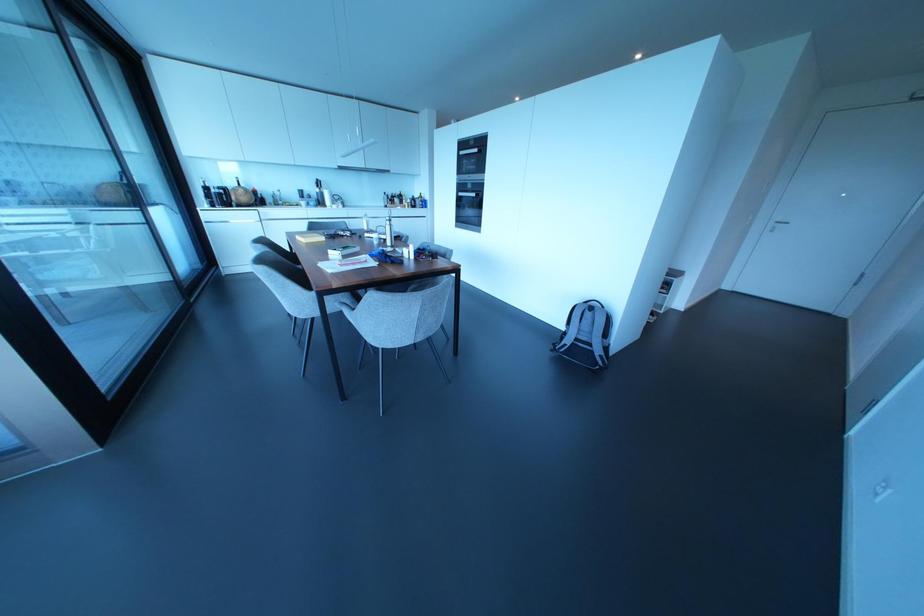
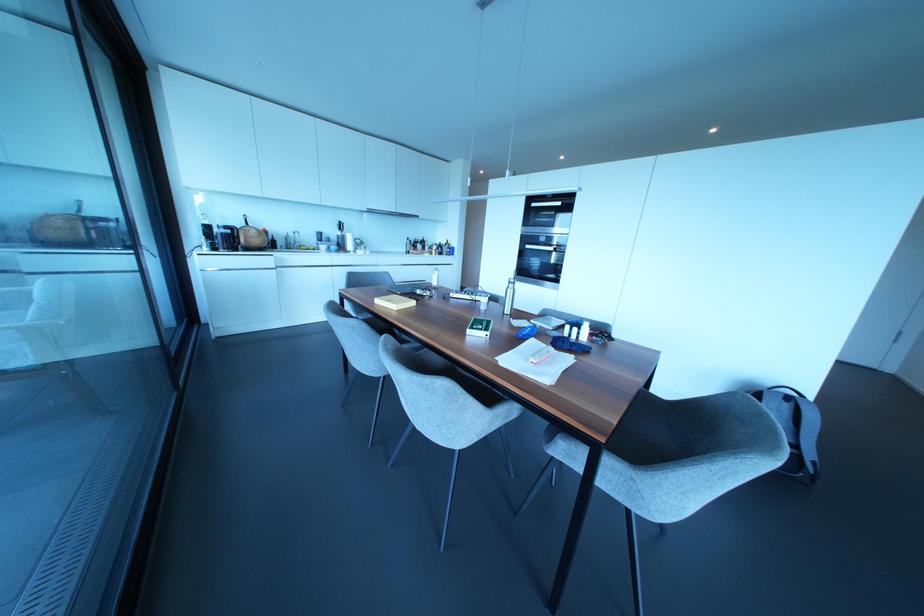
Find the pixel in the second image that matches point 365,228 in the first image.

(434, 283)